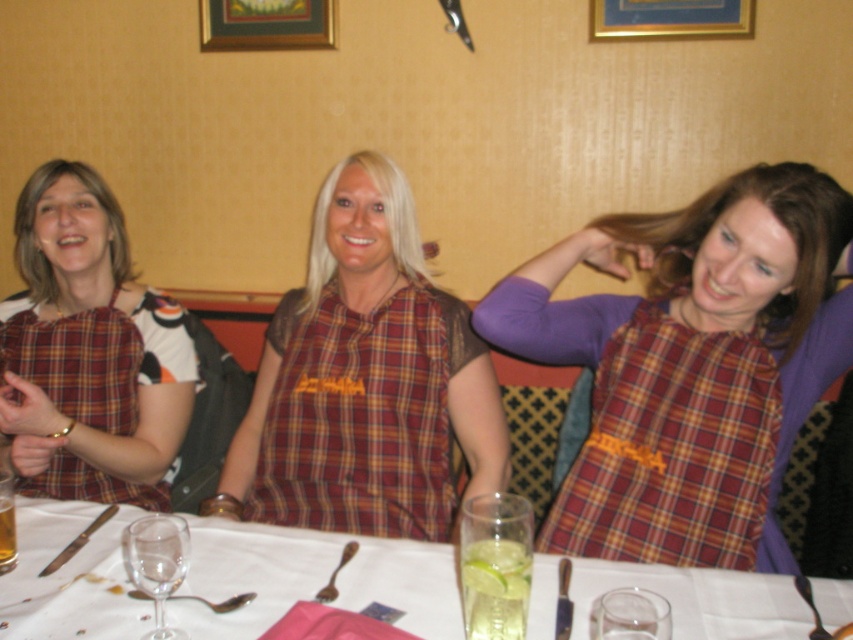
You are a photographer trying to capture a closeup of the clear glass at center. Based on its position, where should you aim your camera to ensure it is centered in the frame?

The clear glass at center is located at point 0.905 on the x axis and 0.367 on the y axis. To center it in the frame, aim your camera at those coordinates.

You are a photographer adjusting the camera height to ensure both the plaid fabric dress at center and the plaid fabric dress at left are fully visible in the frame. Which dress requires the camera to be raised higher to capture its full height?

The plaid fabric dress at left requires the camera to be raised higher because it is taller than the plaid fabric dress at center.

Consider the image. You are a photographer setting up a shot of the three women at the table. You need to decide which object, the plaid fabric shirt at center or the clear glass at center, will be easier to see through. Which one would you choose?

The plaid fabric shirt at center is thinner than the clear glass at center, so the clear glass at center is more transparent and easier to see through.